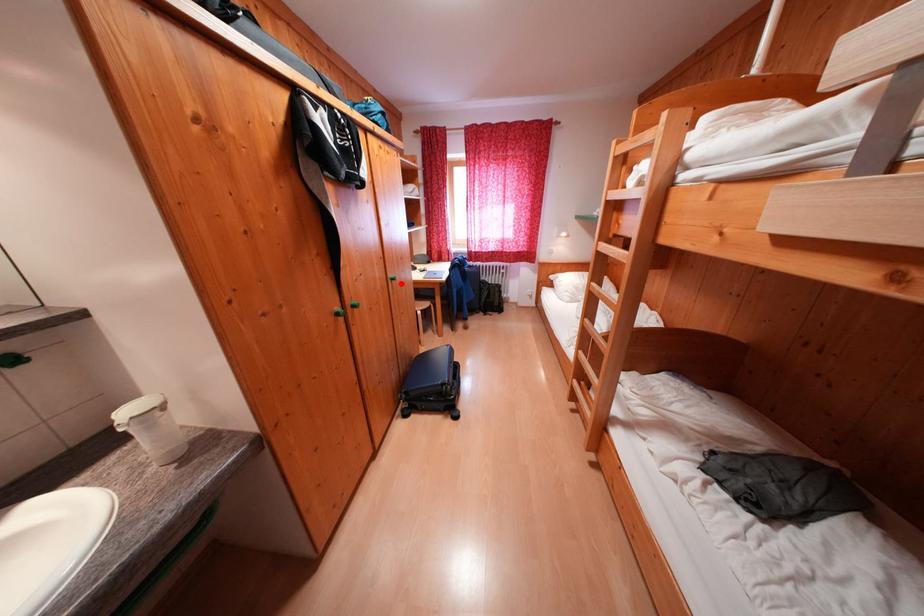
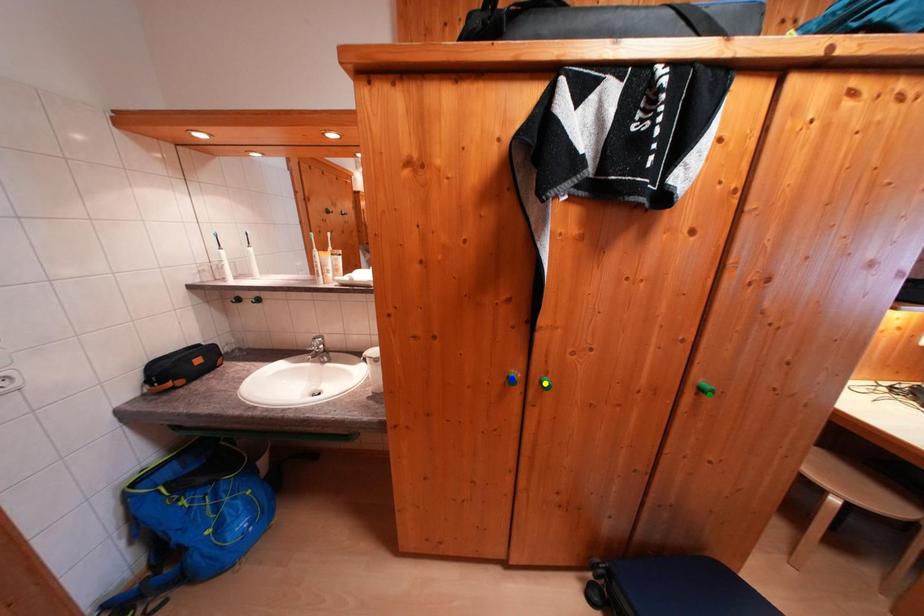
Question: I am providing you with two images of the same scene from different viewpoints. A red point is marked on the first image. You are given multiple points on the second image. Which point in image 2 represents the same 3d spot as the red point in image 1?

Choices:
 (A) green point
 (B) yellow point
 (C) blue point

Answer: (A)